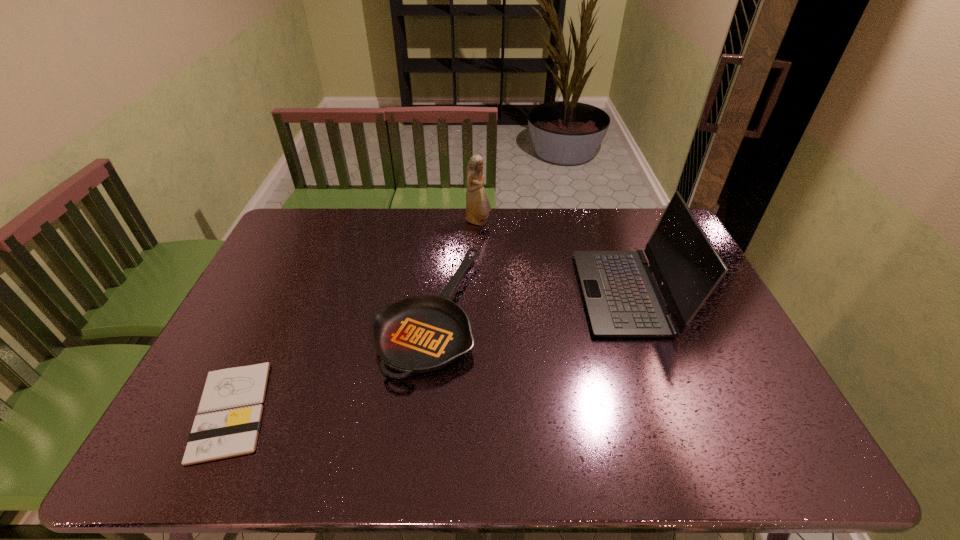
Locate an element on the screen. vacant region located 0.240m on the back of the notepad is located at coordinates (282, 300).

The width and height of the screenshot is (960, 540). I want to click on object present at the far edge, so click(478, 207).

Where is `object that is at the near edge`? Image resolution: width=960 pixels, height=540 pixels. object that is at the near edge is located at coordinates (230, 409).

At what (x,y) coordinates should I click in order to perform the action: click on object at the left edge. Please return your answer as a coordinate pair (x, y). This screenshot has width=960, height=540. Looking at the image, I should click on (230, 409).

Image resolution: width=960 pixels, height=540 pixels. I want to click on object present at the right edge, so click(622, 298).

Find the location of `object present at the near left corner`. object present at the near left corner is located at coordinates (230, 409).

The width and height of the screenshot is (960, 540). What are the coordinates of `blank space at the far edge of the desktop` in the screenshot? It's located at (583, 222).

Where is `free region at the near edge of the desktop`? The width and height of the screenshot is (960, 540). free region at the near edge of the desktop is located at coordinates (331, 456).

In order to click on vacant space at the left edge of the desktop in this screenshot , I will do `click(277, 277)`.

The width and height of the screenshot is (960, 540). I want to click on free space at the right edge of the desktop, so click(720, 325).